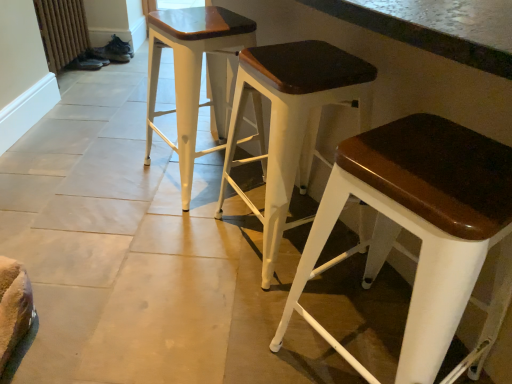
The height and width of the screenshot is (384, 512). I want to click on free space above matte white stool at center, acting as the 2th stool starting from the right (from a real-world perspective), so click(x=308, y=58).